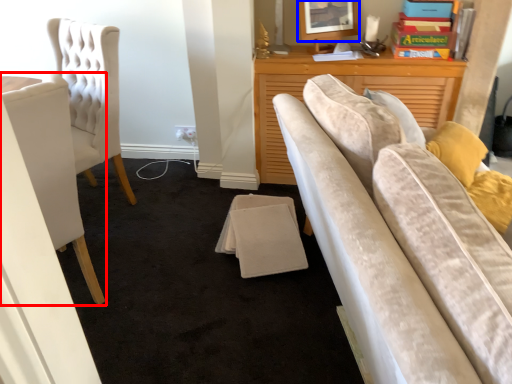
Question: Which object appears closest to the camera in this image, chair (highlighted by a red box) or picture frame (highlighted by a blue box)?

Choices:
 (A) chair
 (B) picture frame

Answer: (A)